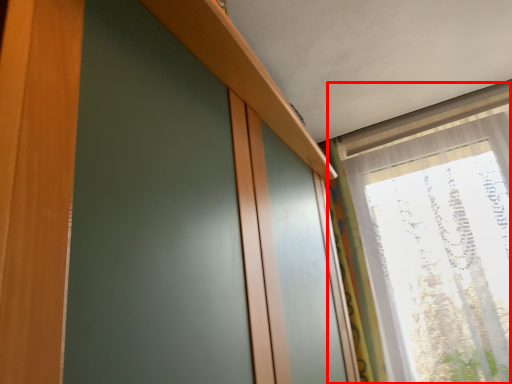
Question: Observing the image, what is the correct spatial positioning of window (annotated by the red box) in reference to curtain?

Choices:
 (A) right
 (B) left

Answer: (A)